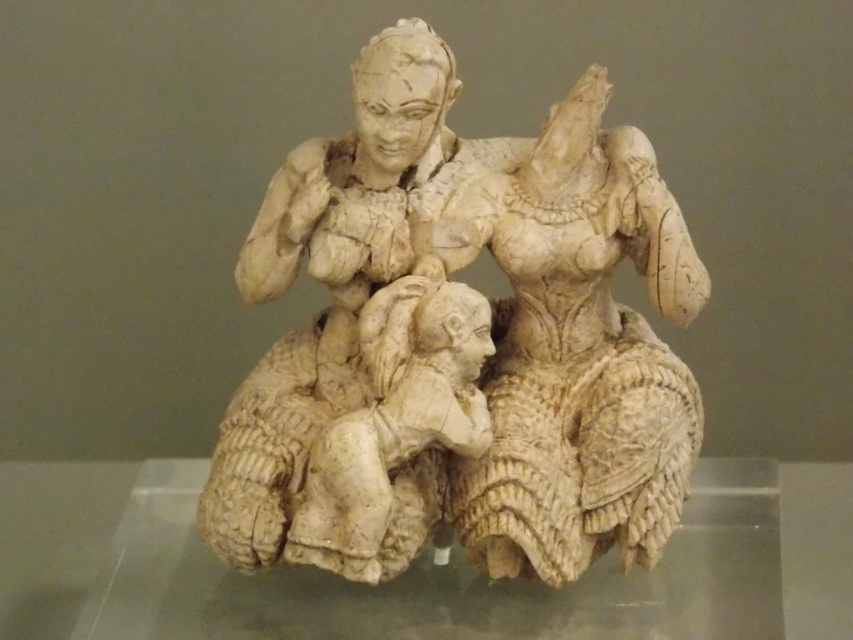
Is ivory sculpture at center bigger than matte beige figure at center?

Yes.

Image resolution: width=853 pixels, height=640 pixels. In order to click on ivory sculpture at center in this screenshot , I will do `click(460, 342)`.

In the scene shown: Is ivory sculpture at center closer to the viewer compared to transparent glass table at center?

Yes.

Between ivory sculpture at center and transparent glass table at center, which one appears on the left side from the viewer's perspective?

transparent glass table at center is more to the left.

Is point (267, 420) less distant than point (57, 481)?

Yes, point (267, 420) is in front of point (57, 481).

Locate an element on the screen. The width and height of the screenshot is (853, 640). ivory sculpture at center is located at coordinates (460, 342).

Based on the photo, can you confirm if matte beige figure at center is shorter than transparent glass table at center?

In fact, matte beige figure at center may be taller than transparent glass table at center.

Between point (425, 512) and point (16, 532), which one is positioned in front?

Positioned in front is point (425, 512).

Find the location of a particular element. matte beige figure at center is located at coordinates (397, 442).